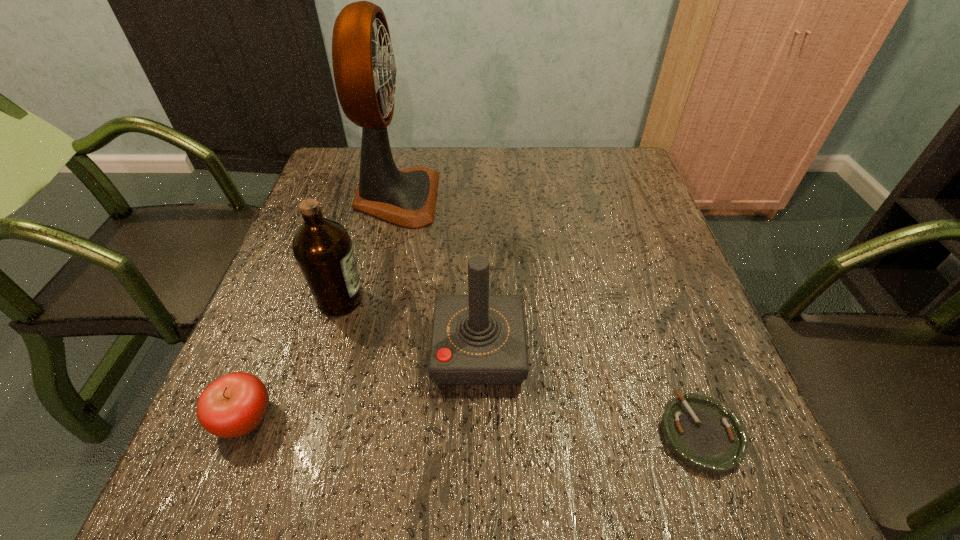
This screenshot has width=960, height=540. I want to click on vacant space situated 0.400m on the back of the apple, so click(x=315, y=241).

Locate an element on the screen. The width and height of the screenshot is (960, 540). free space located 0.330m on the left of the shortest object is located at coordinates (460, 433).

Locate an element on the screen. This screenshot has height=540, width=960. object located in the far edge section of the desktop is located at coordinates (364, 68).

Where is `object that is positioned at the near edge`? The height and width of the screenshot is (540, 960). object that is positioned at the near edge is located at coordinates (702, 434).

Identify the location of fan that is at the left edge. This screenshot has width=960, height=540. (364, 68).

Where is `olive oil present at the left edge`? The width and height of the screenshot is (960, 540). olive oil present at the left edge is located at coordinates (323, 250).

At what (x,y) coordinates should I click in order to perform the action: click on apple that is at the left edge. Please return your answer as a coordinate pair (x, y). Image resolution: width=960 pixels, height=540 pixels. Looking at the image, I should click on (235, 404).

Locate an element on the screen. object present at the right edge is located at coordinates (702, 434).

This screenshot has height=540, width=960. In order to click on object situated at the far left corner in this screenshot , I will do `click(364, 68)`.

Where is `object that is at the near right corner`? This screenshot has width=960, height=540. object that is at the near right corner is located at coordinates (702, 434).